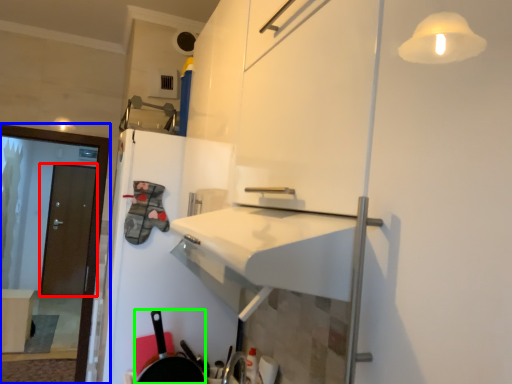
Question: Estimate the real-world distances between objects in this image. Which object is closer to door (highlighted by a red box), screen door (highlighted by a blue box) or frying pan (highlighted by a green box)?

Choices:
 (A) screen door
 (B) frying pan

Answer: (A)